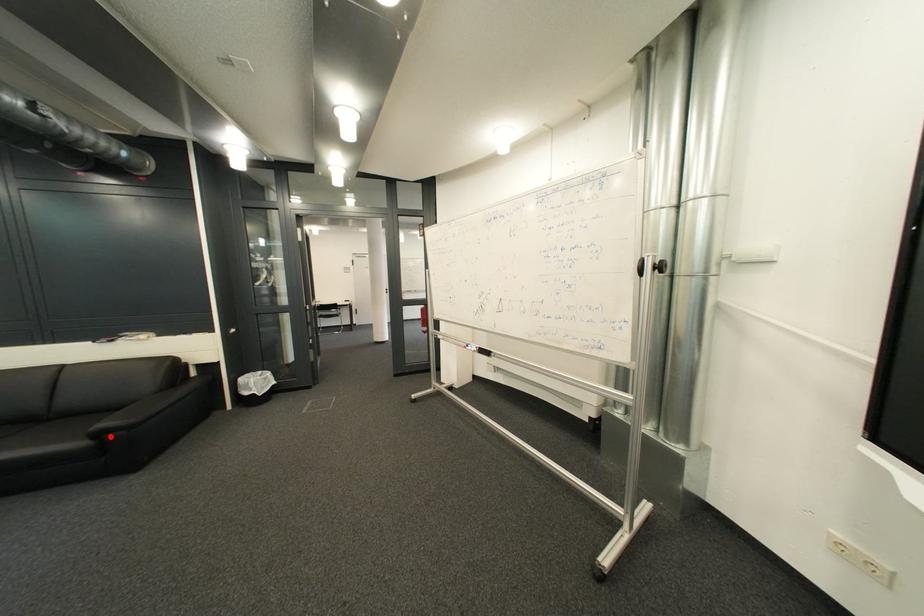
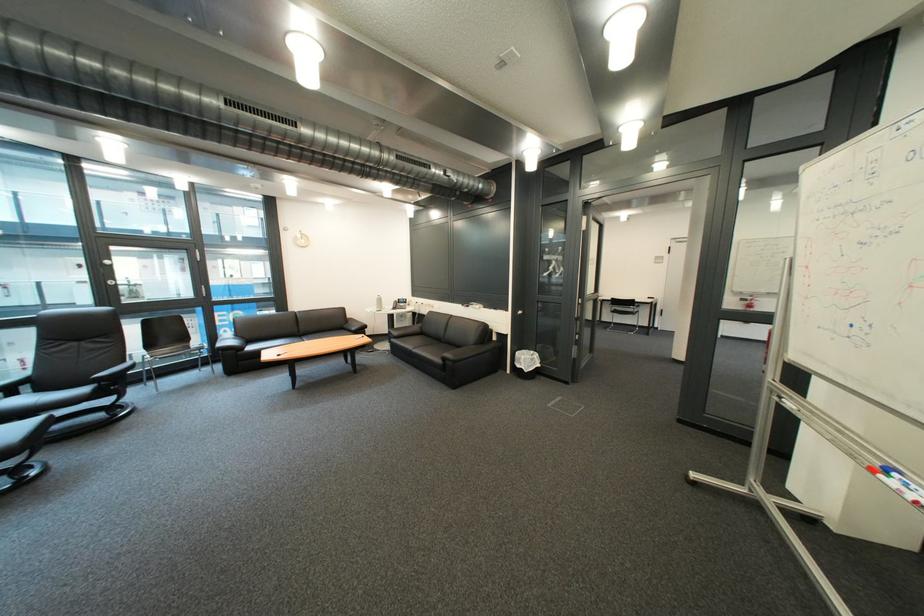
The point at the highlighted location is marked in the first image. Where is the corresponding point in the second image?

(457, 361)